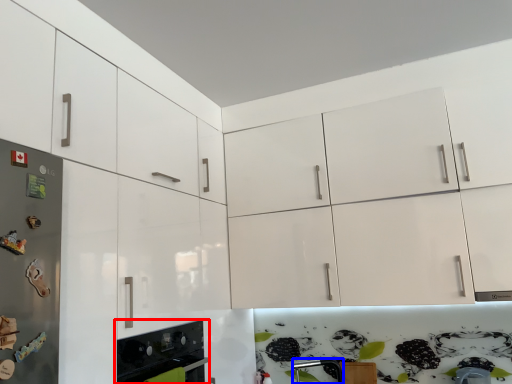
Question: Which object is closer to the camera taking this photo, home appliance (highlighted by a red box) or silver (highlighted by a blue box)?

Choices:
 (A) home appliance
 (B) silver

Answer: (A)